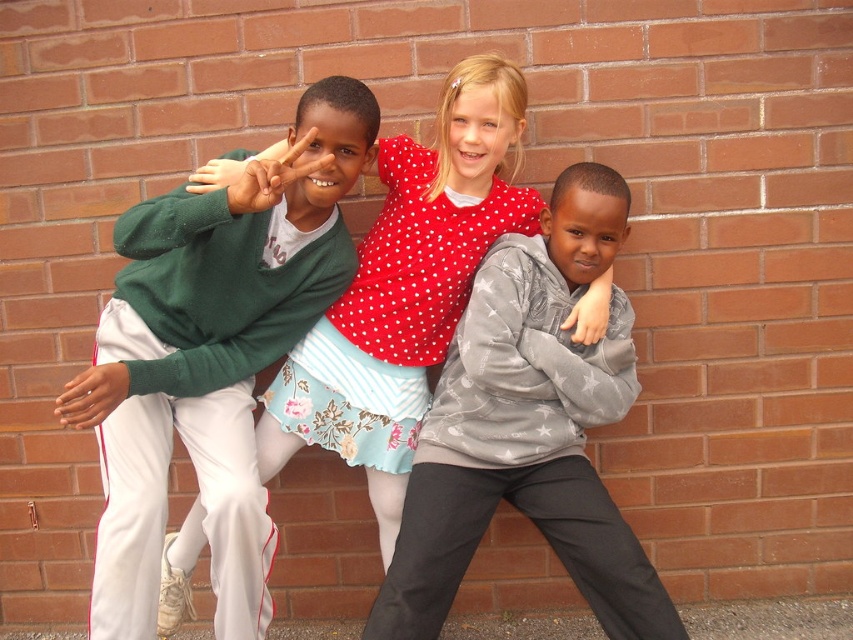
Question: Which of the following is the closest to the observer?

Choices:
 (A) green sweater at left
 (B) gray velvety sweatshirt at center

Answer: (A)

Question: Can you confirm if green sweater at left is positioned to the left of gray velvety sweatshirt at center?

Choices:
 (A) no
 (B) yes

Answer: (B)

Question: Does green sweater at left lie behind polka dot fabric dress at center?

Choices:
 (A) no
 (B) yes

Answer: (A)

Question: Is green sweater at left bigger than gray velvety sweatshirt at center?

Choices:
 (A) yes
 (B) no

Answer: (A)

Question: Among these objects, which one is farthest from the camera?

Choices:
 (A) green sweater at left
 (B) polka dot fabric dress at center

Answer: (B)

Question: Which object appears farthest from the camera in this image?

Choices:
 (A) green sweater at left
 (B) gray velvety sweatshirt at center

Answer: (B)